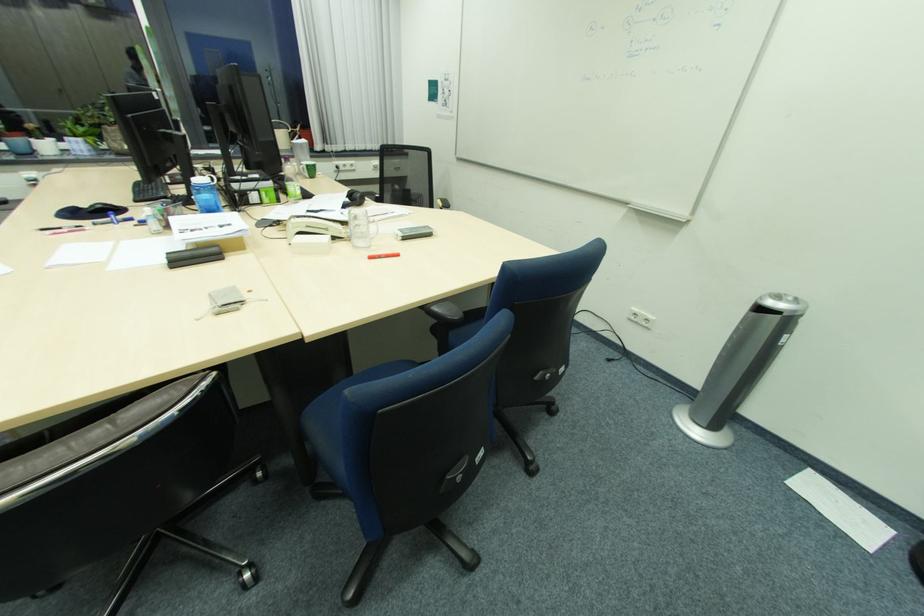
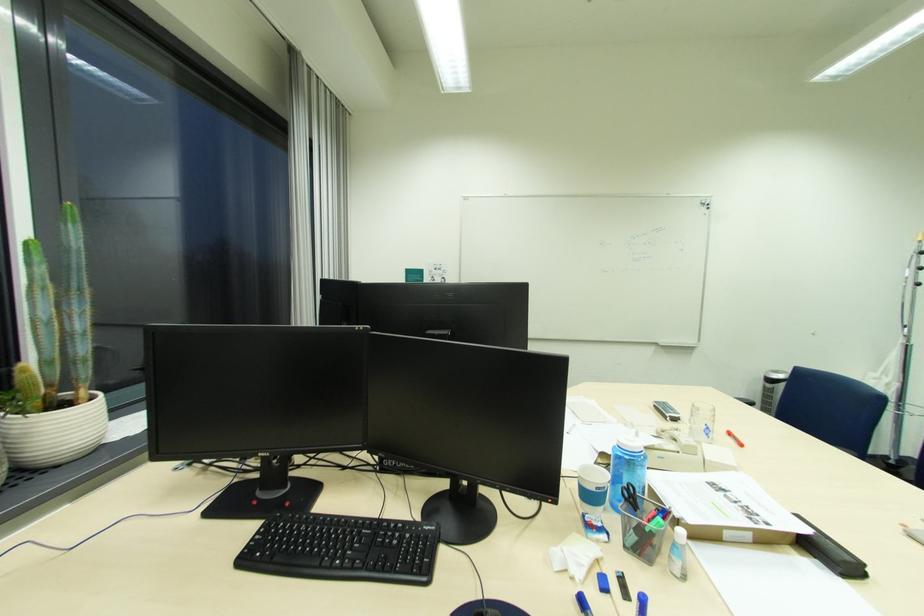
Find the pixel in the second image that matches [784,297] in the first image.

(782, 373)